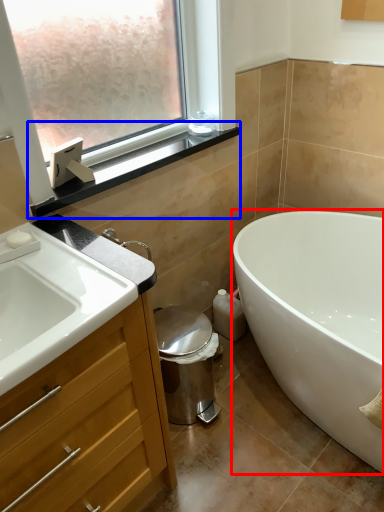
Question: Among these objects, which one is farthest to the camera, bathtub (highlighted by a red box) or window sill (highlighted by a blue box)?

Choices:
 (A) bathtub
 (B) window sill

Answer: (B)